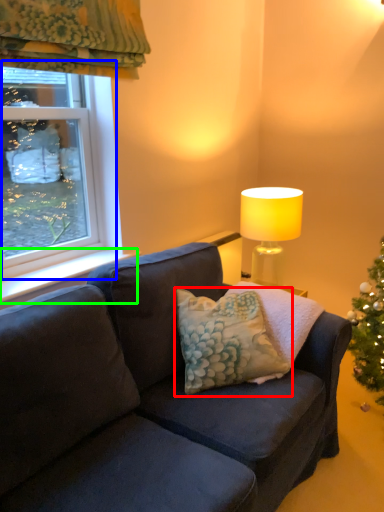
Question: Considering the real-world distances, which object is farthest from pillow (highlighted by a red box)? window (highlighted by a blue box) or window sill (highlighted by a green box)?

Choices:
 (A) window
 (B) window sill

Answer: (A)